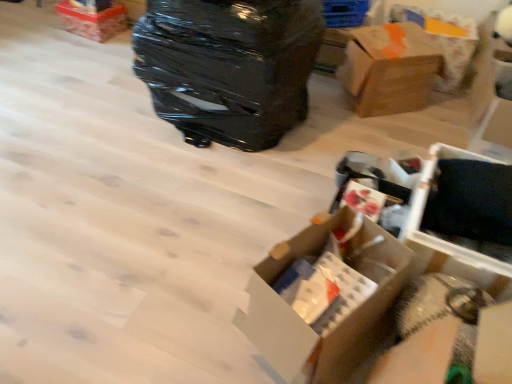
What are the coordinates of `vacant area on top of matte cardboard box at upper left, the 3th box in the front-to-back sequence (from a real-world perspective)` in the screenshot? It's located at (93, 6).